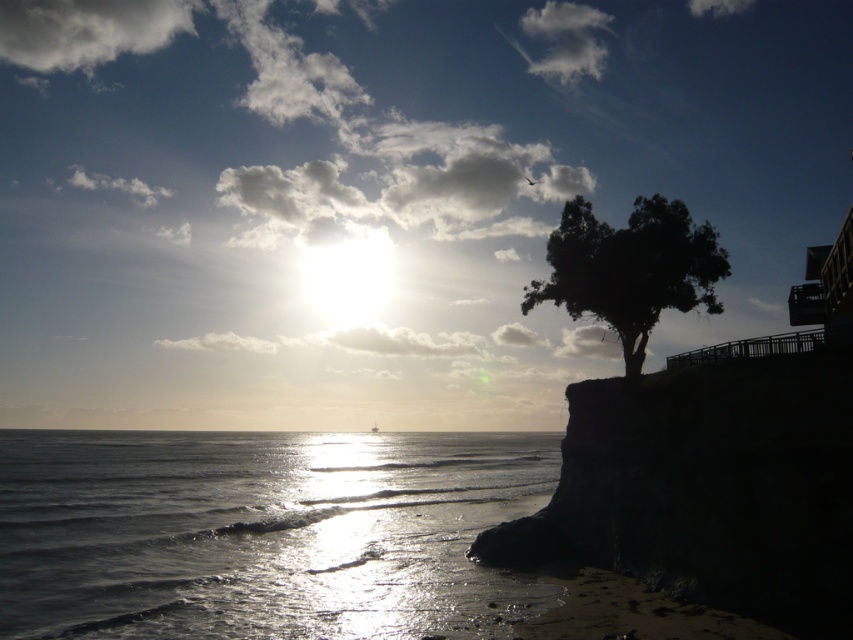
Question: Which point appears closest to the camera in this image?

Choices:
 (A) (26, 540)
 (B) (669, 248)

Answer: (A)

Question: Is the position of glistening silver water at lower left less distant than that of dark green leafy tree at upper right?

Choices:
 (A) yes
 (B) no

Answer: (A)

Question: Which point is closer to the camera?

Choices:
 (A) dark green leafy tree at upper right
 (B) glistening silver water at lower left

Answer: (B)

Question: From the image, what is the correct spatial relationship of glistening silver water at lower left in relation to dark green leafy tree at upper right?

Choices:
 (A) below
 (B) above

Answer: (A)

Question: Which point is farther to the camera?

Choices:
 (A) (541, 298)
 (B) (76, 444)

Answer: (B)

Question: Can you confirm if glistening silver water at lower left is positioned above dark green leafy tree at upper right?

Choices:
 (A) yes
 (B) no

Answer: (B)